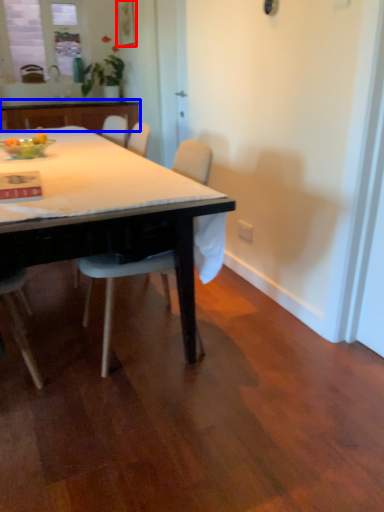
Question: Among these objects, which one is nearest to the camera, picture frame (highlighted by a red box) or cabinetry (highlighted by a blue box)?

Choices:
 (A) picture frame
 (B) cabinetry

Answer: (B)